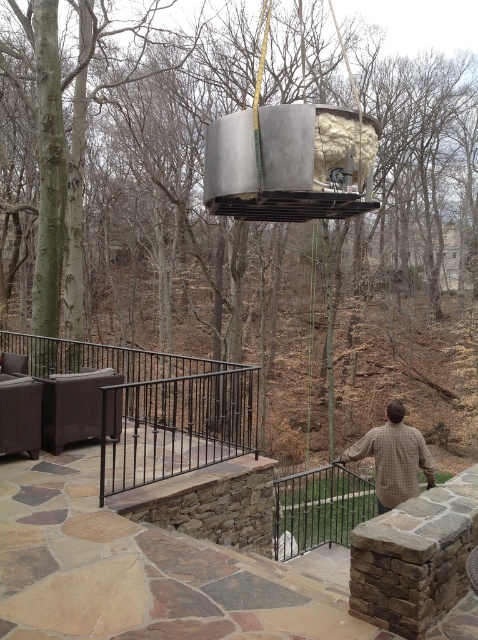
You are standing on the patio and want to sit down on the brown wicker sofa at lower left. Can you easily walk around the black metal railing at lower center to reach it?

The black metal railing at lower center is positioned under the brown wicker sofa at lower left, so you can easily walk around it to reach the sofa.

You are standing on the stone patio and want to know the exact location of the black metal railing at lower center. What are its coordinates?

The black metal railing at lower center is located at coordinates point (318, 508).